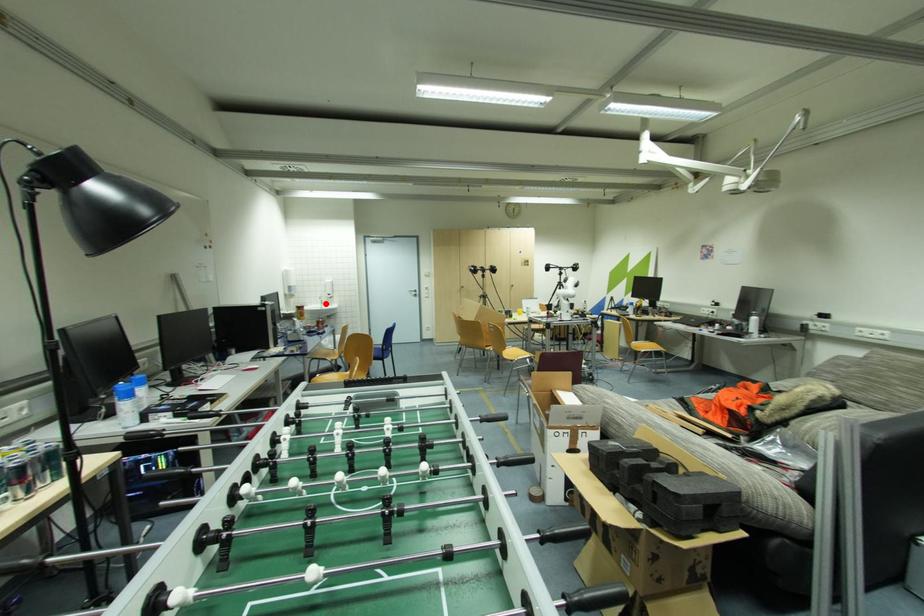
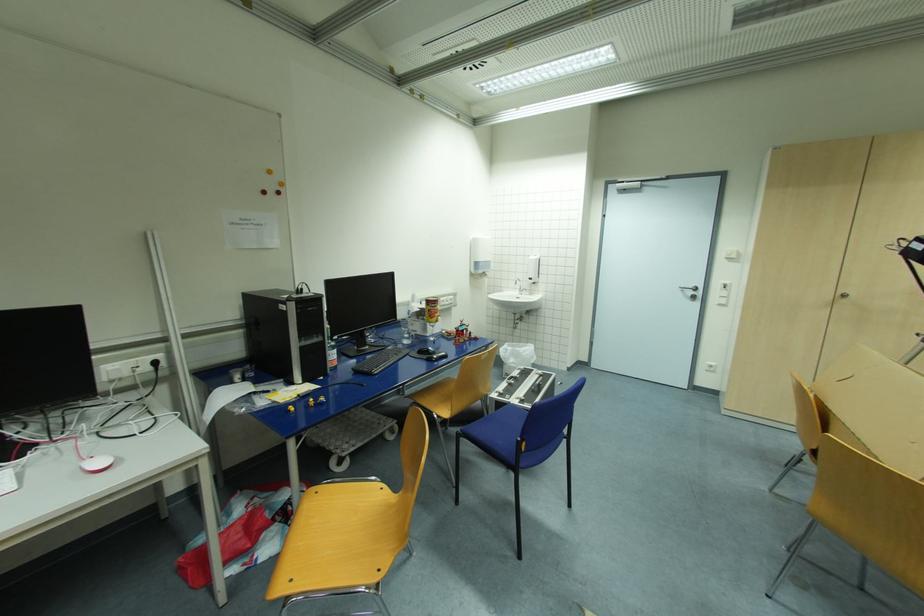
Locate, in the second image, the point that corresponds to the highlighted location in the first image.

(525, 291)